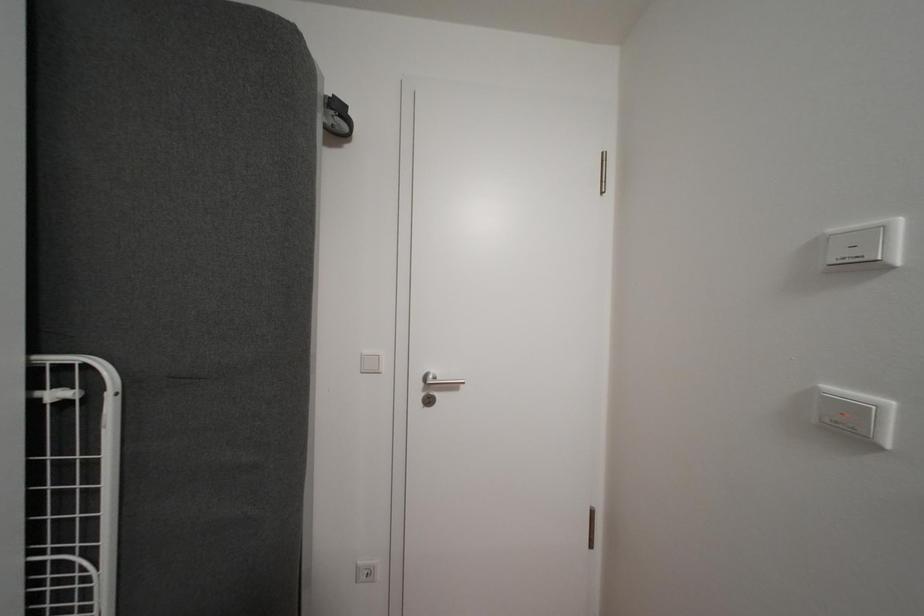
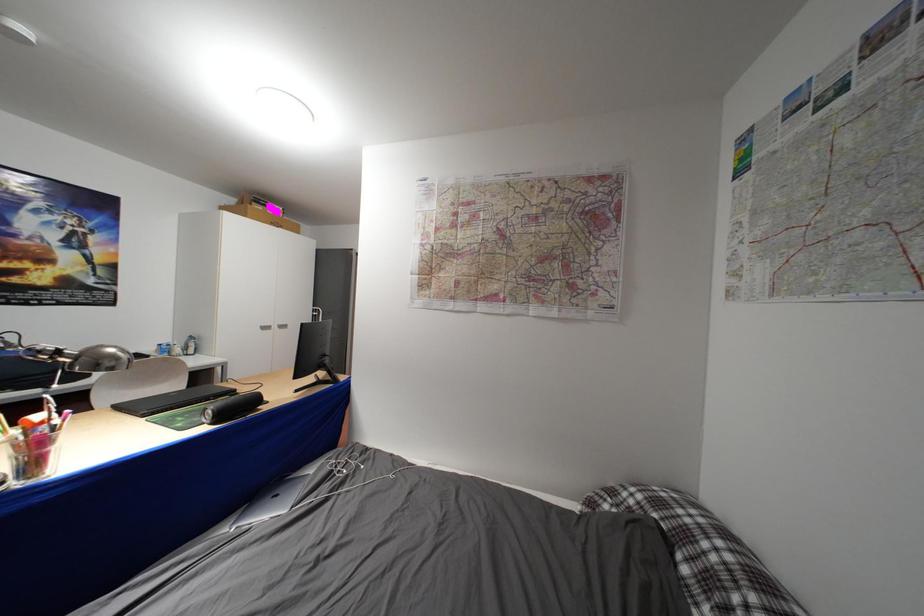
Which direction would the cameraman need to move to produce the second image?

The cameraman moved toward right, backward.